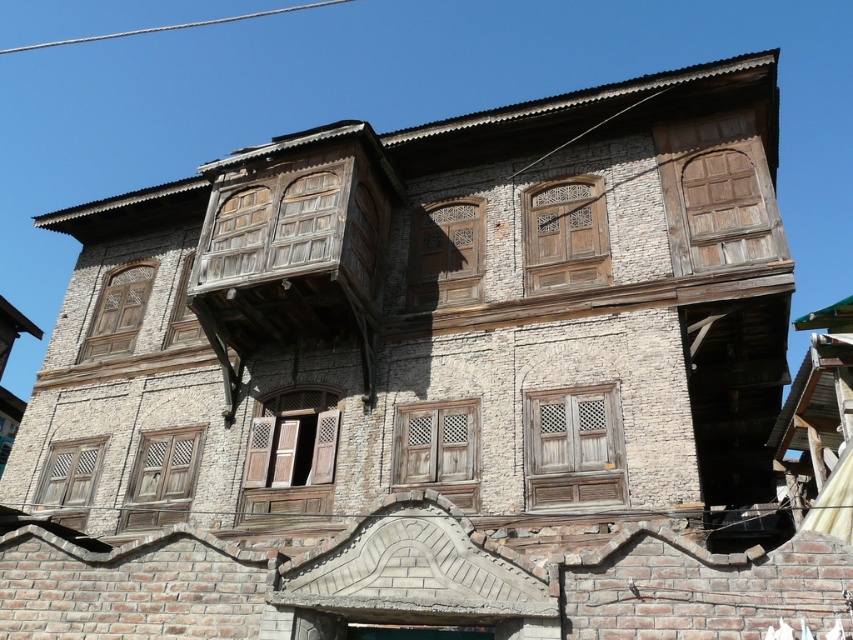
Question: Can you confirm if weathered wood window at center is positioned above wooden lattice window at lower left?

Choices:
 (A) yes
 (B) no

Answer: (A)

Question: Which of the following is the closest to the observer?

Choices:
 (A) (531, 506)
 (B) (93, 324)
 (C) (425, 449)
 (D) (757, 138)

Answer: (A)

Question: Is weathered wood window at center positioned at the back of wooden lattice window at upper left?

Choices:
 (A) no
 (B) yes

Answer: (A)

Question: Among these points, which one is farthest from the camera?

Choices:
 (A) (140, 284)
 (B) (270, 483)

Answer: (A)

Question: Does wooden lattice door at center have a greater width compared to wooden lattice window at center?

Choices:
 (A) no
 (B) yes

Answer: (B)

Question: Which of the following is the closest to the observer?

Choices:
 (A) weathered wood window at center
 (B) wooden at upper right
 (C) wooden carved door at center
 (D) wooden lattice window at upper left

Answer: (A)